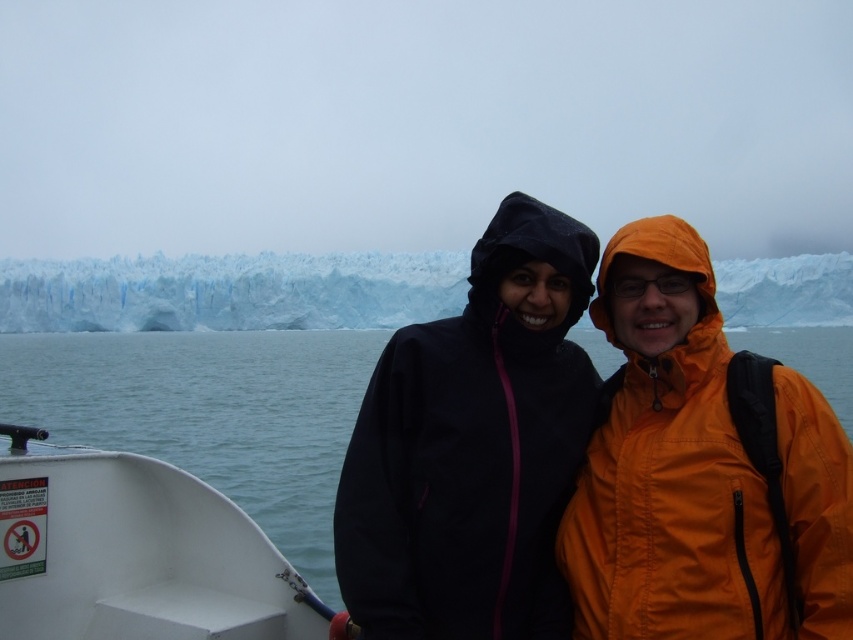
Is matte black jacket at center to the left of white ice glacier at upper center from the viewer's perspective?

No, matte black jacket at center is not to the left of white ice glacier at upper center.

Can you confirm if matte black jacket at center is shorter than white ice glacier at upper center?

Yes, matte black jacket at center is shorter than white ice glacier at upper center.

Is point (799, 600) behind point (241, 317)?

No, it is in front of (241, 317).

You are a GUI agent. You are given a task and a screenshot of the screen. Output one action in this format:
    pyautogui.click(x=<x>, y=<y>)
    Task: Click on the matte black jacket at center
    This screenshot has width=853, height=640.
    Given the screenshot: What is the action you would take?
    pyautogui.click(x=592, y=460)

Can you confirm if blue water at lower left is smaller than white ice glacier at upper center?

Actually, blue water at lower left might be larger than white ice glacier at upper center.

Does point (70, 412) lie behind point (236, 260)?

No, (70, 412) is closer to viewer.

Locate an element on the screen. The width and height of the screenshot is (853, 640). blue water at lower left is located at coordinates point(209,412).

Is white matte boat at lower left behind white ice glacier at upper center?

No, white matte boat at lower left is in front of white ice glacier at upper center.

Does point (160, 621) come farther from viewer compared to point (48, 324)?

No, it is not.

Who is more distant from viewer, (9, 560) or (364, 291)?

Positioned behind is point (364, 291).

Identify the location of white matte boat at lower left. This screenshot has width=853, height=640. (137, 554).